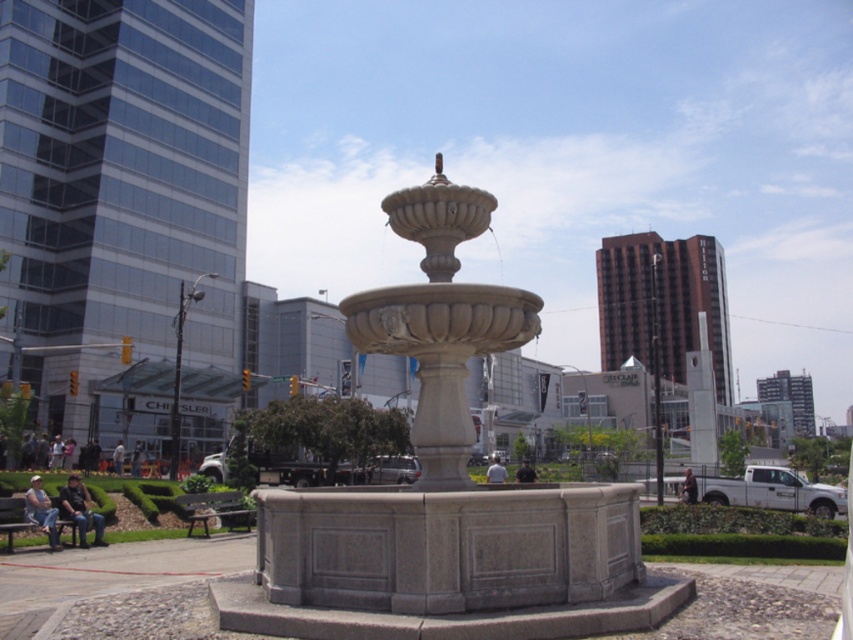
You are standing at the central stone fountain and want to sit down. There are two benches available. Which bench should you choose if you want to be closer to the fountain? The wooden park bench at lower left or the green wooden bench at lower left?

The wooden park bench at lower left is located below the green wooden bench at lower left, so the wooden park bench at lower left is closer to the fountain. Therefore, you should choose the wooden park bench at lower left.

You are standing at the entrance of the plaza and want to reach the gray stone fountain at center. Which direction should you walk to get there?

You should walk towards the center of the plaza to reach the gray stone fountain at center, as it is located at point (445, 492).

You are standing at the edge of the plaza and want to reach the green wooden bench at lower left. Which direction should you move relative to the gray stone fountain at center?

Since the gray stone fountain at center is in front of the green wooden bench at lower left, you should move behind the gray stone fountain at center to reach the green wooden bench at lower left.